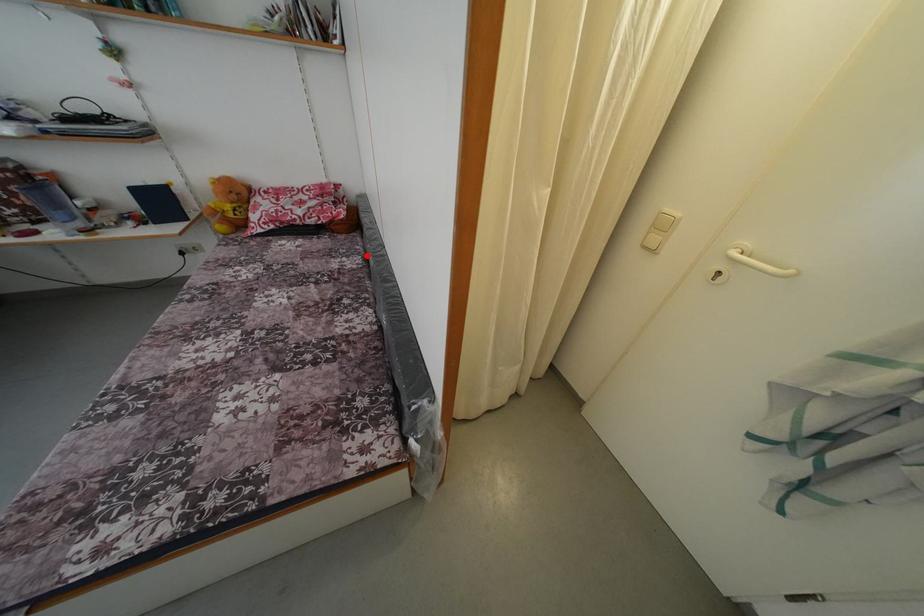
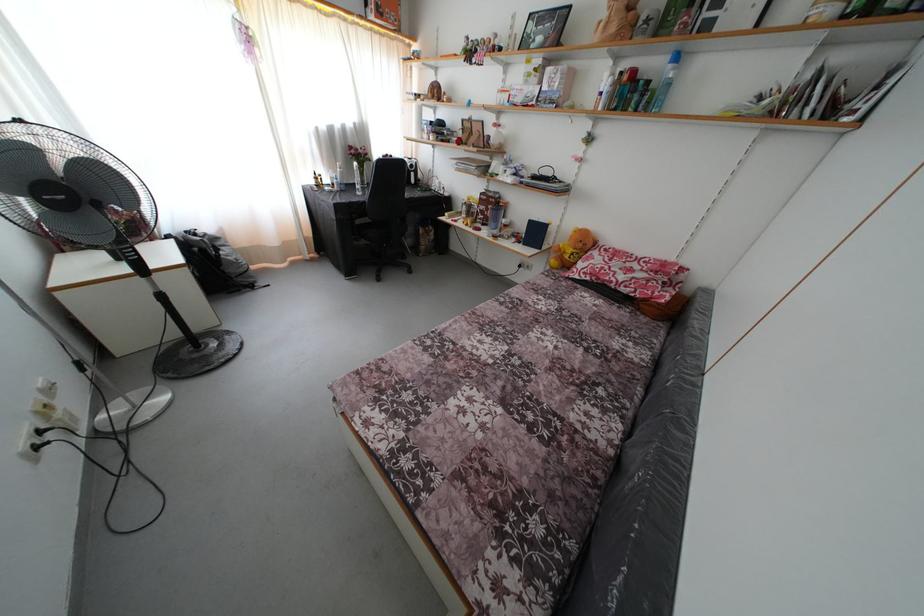
Find the pixel in the second image that matches the highlighted location in the first image.

(663, 353)